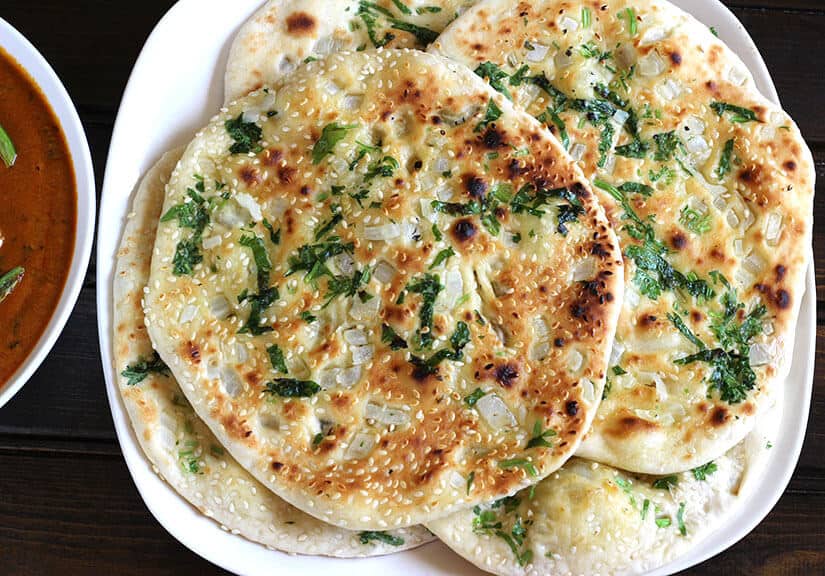
Find the location of `bowl`. bowl is located at coordinates (59, 96).